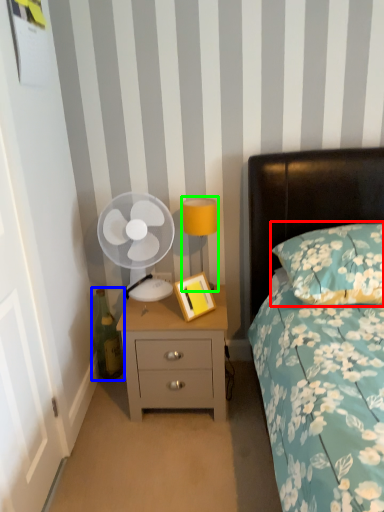
Question: Which object is positioned farthest from pillow (highlighted by a red box)? Select from bottle (highlighted by a blue box) and bedside lamp (highlighted by a green box).

Choices:
 (A) bottle
 (B) bedside lamp

Answer: (A)